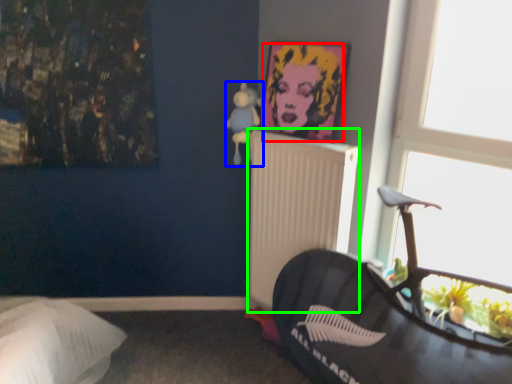
Question: Based on their relative distances, which object is nearer to person (highlighted by a red box)? Choose from toy (highlighted by a blue box) and radiator (highlighted by a green box).

Choices:
 (A) toy
 (B) radiator

Answer: (A)